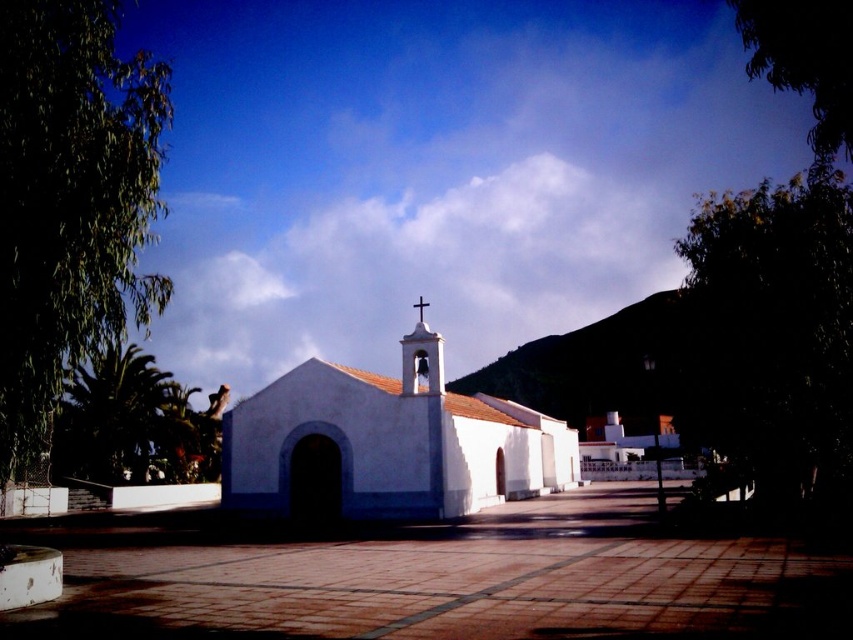
In order to click on white matte church at center in this screenshot , I will do `click(387, 444)`.

Who is shorter, white matte church at center or white wooden cross at center?

white wooden cross at center

Where is `white matte church at center`? This screenshot has height=640, width=853. white matte church at center is located at coordinates (387, 444).